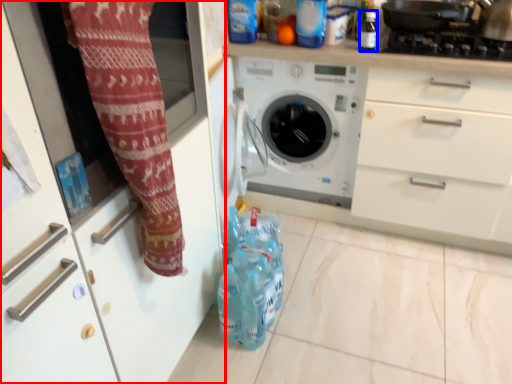
Question: Among these objects, which one is nearest to the camera, cabinetry (highlighted by a red box) or bottle (highlighted by a blue box)?

Choices:
 (A) cabinetry
 (B) bottle

Answer: (A)